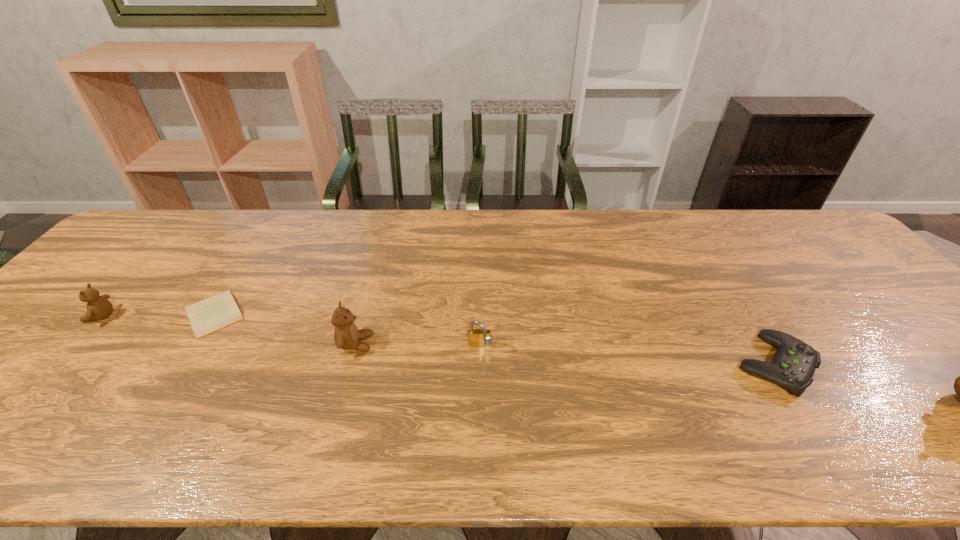
The width and height of the screenshot is (960, 540). What are the coordinates of `free space located on the front-facing side of the left teddy bear` in the screenshot? It's located at (68, 316).

The height and width of the screenshot is (540, 960). Find the location of `vacant region located 0.100m on the front-facing side of the left teddy bear`. vacant region located 0.100m on the front-facing side of the left teddy bear is located at coordinates (49, 316).

Identify the location of free space located 0.340m on the front-facing side of the right teddy bear. This screenshot has width=960, height=540. (512, 344).

This screenshot has width=960, height=540. What are the coordinates of `vacant region located on the side with the combination dials of the padlock` in the screenshot? It's located at (480, 370).

I want to click on free spot located 0.080m on the back of the rightmost object, so click(741, 311).

Image resolution: width=960 pixels, height=540 pixels. What are the coordinates of `free spot located 0.160m on the left of the shortest object` in the screenshot? It's located at (119, 313).

The width and height of the screenshot is (960, 540). In order to click on object that is at the near edge in this screenshot , I will do `click(793, 365)`.

Locate an element on the screen. object located in the left edge section of the desktop is located at coordinates (98, 307).

In order to click on free location at the far edge of the desktop in this screenshot , I will do pyautogui.click(x=287, y=210).

The height and width of the screenshot is (540, 960). Find the location of `vacant space at the near edge`. vacant space at the near edge is located at coordinates (824, 383).